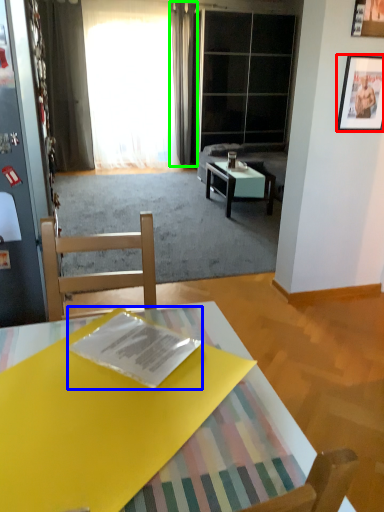
Question: Estimate the real-world distances between objects in this image. Which object is farther from picture frame (highlighted by a red box), magazine (highlighted by a blue box) or curtain (highlighted by a green box)?

Choices:
 (A) magazine
 (B) curtain

Answer: (B)